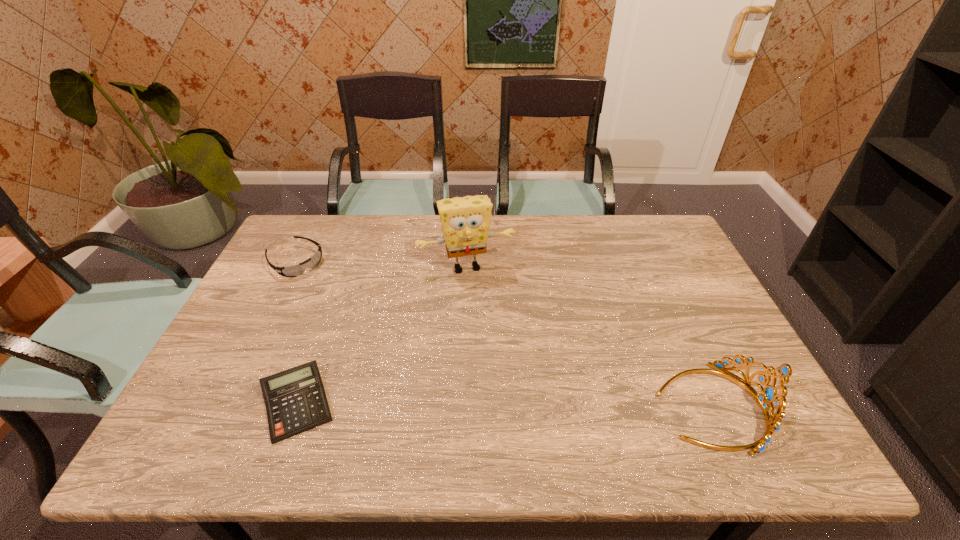
I want to click on free space between the rightmost object and the sponge, so click(589, 336).

At what (x,y) coordinates should I click in order to perform the action: click on free space between the calculator and the sunglasses. Please return your answer as a coordinate pair (x, y). The image size is (960, 540). Looking at the image, I should click on coord(297,333).

I want to click on vacant space in between the sponge and the calculator, so click(x=382, y=335).

Find the location of a particular element. Image resolution: width=960 pixels, height=540 pixels. free space between the sunglasses and the rightmost object is located at coordinates (503, 334).

The width and height of the screenshot is (960, 540). Find the location of `vacant region between the calculator and the second tallest object`. vacant region between the calculator and the second tallest object is located at coordinates (505, 405).

The width and height of the screenshot is (960, 540). I want to click on free spot between the sunglasses and the second tallest object, so click(503, 334).

You are a GUI agent. You are given a task and a screenshot of the screen. Output one action in this format:
    pyautogui.click(x=<x>, y=<y>)
    Task: Click on the vacant space in between the sunglasses and the second tallest object
    This screenshot has width=960, height=540.
    Given the screenshot: What is the action you would take?
    pyautogui.click(x=503, y=334)

Identify the location of object that stands as the closest to the rightmost object. (465, 221).

Identify the location of object that ranks as the third closest to the sunglasses. (769, 395).

In order to click on vacant position in the image that satisfies the following two spatial constraints: 1. on the front side of the sunglasses; 2. on the left side of the tallest object in this screenshot , I will do `click(293, 267)`.